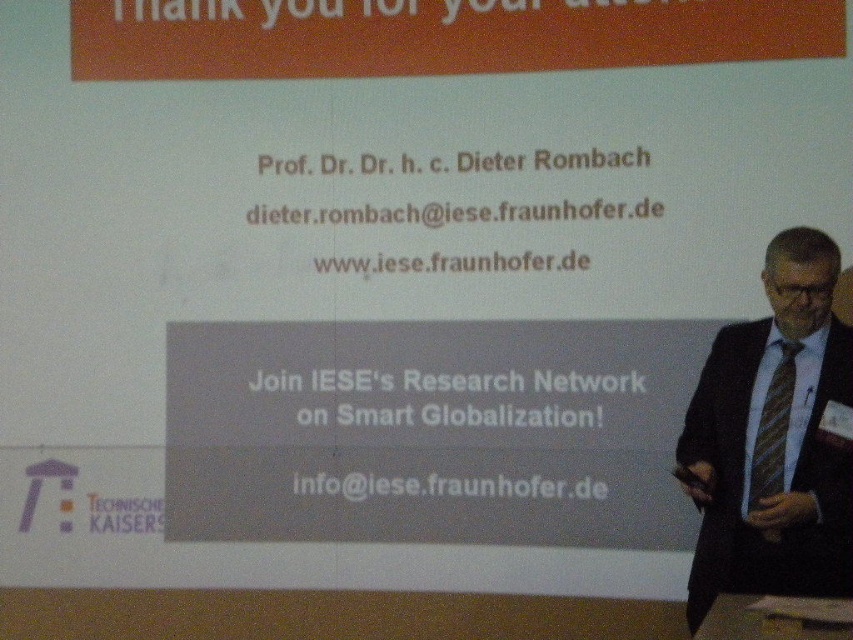
Question: Which of the following is the farthest from the observer?

Choices:
 (A) black suit at right
 (B) striped fabric tie at right

Answer: (B)

Question: Does black suit at right have a smaller size compared to striped fabric tie at right?

Choices:
 (A) no
 (B) yes

Answer: (A)

Question: Can you confirm if black suit at right is positioned to the left of striped fabric tie at right?

Choices:
 (A) yes
 (B) no

Answer: (A)

Question: Which point is closer to the camera taking this photo?

Choices:
 (A) (827, 348)
 (B) (770, 490)

Answer: (B)

Question: Is black suit at right wider than striped fabric tie at right?

Choices:
 (A) yes
 (B) no

Answer: (A)